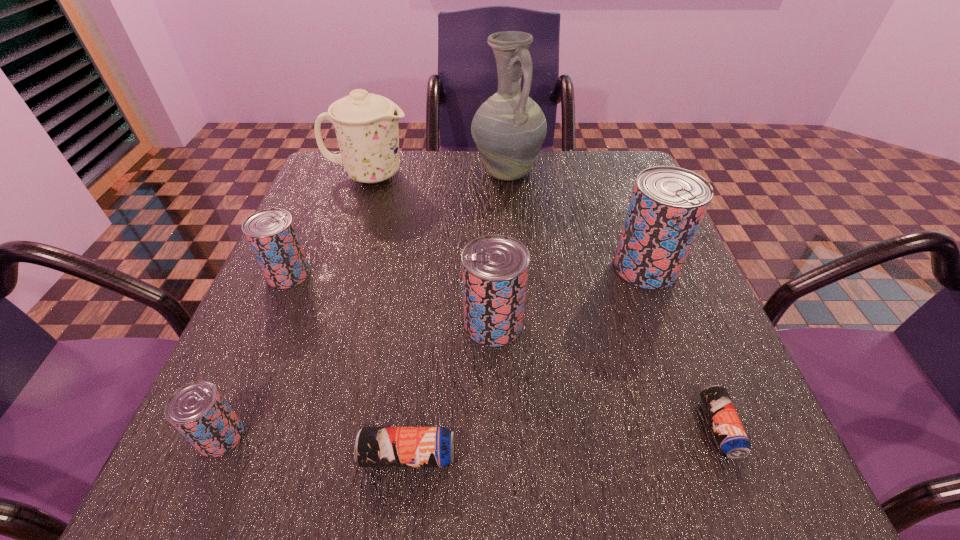
The image size is (960, 540). In order to click on free space located on the right of the third beer can from left to right in this screenshot , I will do `click(594, 455)`.

Locate an element on the screen. The width and height of the screenshot is (960, 540). vacant space located on the left of the shortest beer can is located at coordinates (606, 427).

The height and width of the screenshot is (540, 960). I want to click on pitcher present at the far edge, so click(508, 129).

Identify the location of chinaware present at the far edge. This screenshot has height=540, width=960. (366, 125).

Find the location of a particular element. This screenshot has width=960, height=540. chinaware positioned at the left edge is located at coordinates (366, 125).

Identify the location of object present at the far left corner. (366, 125).

What are the coordinates of `object situated at the near left corner` in the screenshot? It's located at (198, 410).

Where is `object present at the near right corner`? This screenshot has width=960, height=540. object present at the near right corner is located at coordinates (731, 436).

Locate an element on the screen. This screenshot has height=540, width=960. free region at the far edge of the desktop is located at coordinates point(447,168).

In the image, there is a desktop. Where is `vacant space at the near edge`? This screenshot has height=540, width=960. vacant space at the near edge is located at coordinates (511, 465).